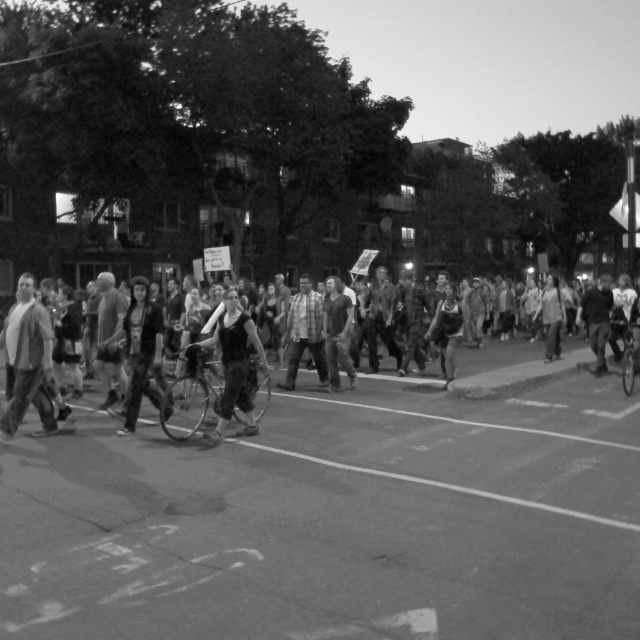
Question: Estimate the real-world distances between objects in this image. Which object is closer to the denim pants at center?

Choices:
 (A) dark fabric shirt at center
 (B) black fabric dress at center

Answer: (B)

Question: Among these objects, which one is farthest from the camera?

Choices:
 (A) black fabric dress at center
 (B) denim pants at center

Answer: (B)

Question: Can you confirm if black fabric dress at center is bigger than dark fabric shirt at center?

Choices:
 (A) no
 (B) yes

Answer: (A)

Question: In this image, where is matte gray shirt at left located relative to dark fabric shirt at center?

Choices:
 (A) right
 (B) left

Answer: (B)

Question: Does matte gray shirt at left appear over black fabric dress at center?

Choices:
 (A) no
 (B) yes

Answer: (B)

Question: Which object appears closest to the camera in this image?

Choices:
 (A) matte gray shirt at left
 (B) denim pants at center

Answer: (A)